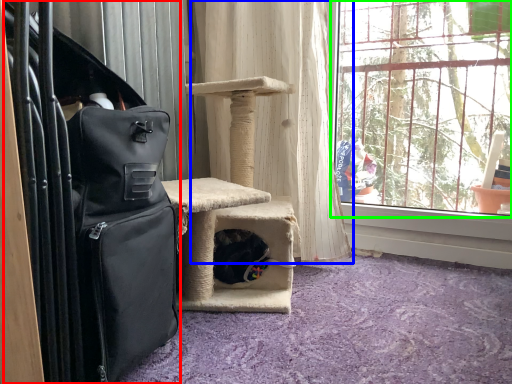
Question: Based on their relative distances, which object is nearer to luggage (highlighted by a red box)? Choose from curtain (highlighted by a blue box) and window (highlighted by a green box).

Choices:
 (A) curtain
 (B) window

Answer: (A)